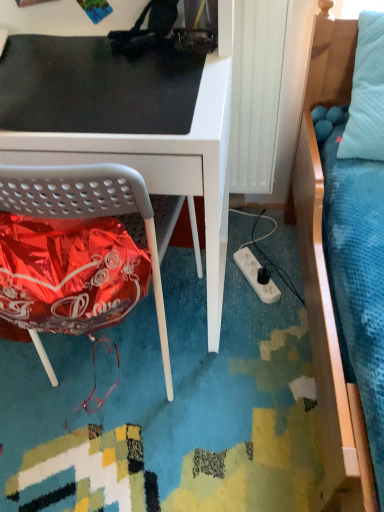
Question: In the image, is black matte mousepad at upper left on the left side or the right side of white plastic power outlet at lower center?

Choices:
 (A) left
 (B) right

Answer: (A)

Question: From a real-world perspective, is black matte mousepad at upper left physically located above or below white plastic power outlet at lower center?

Choices:
 (A) below
 (B) above

Answer: (B)

Question: Based on their relative distances, which object is farther from the black matte mousepad at upper left?

Choices:
 (A) white matte desk at center
 (B) white plastic power outlet at lower center

Answer: (B)

Question: Which of these objects is positioned closest to the white plastic power outlet at lower center?

Choices:
 (A) black matte mousepad at upper left
 (B) white matte desk at center

Answer: (B)